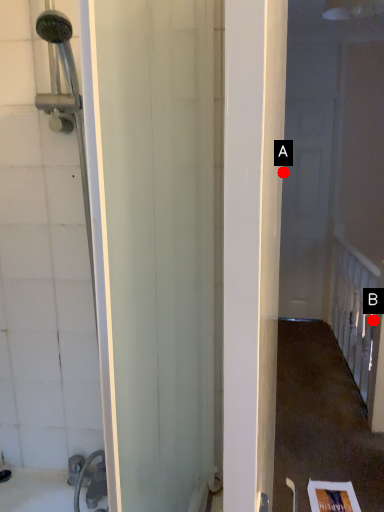
Question: Two points are circled on the image, labeled by A and B beside each circle. Which point is farther from the camera taking this photo?

Choices:
 (A) A is further
 (B) B is further

Answer: (A)